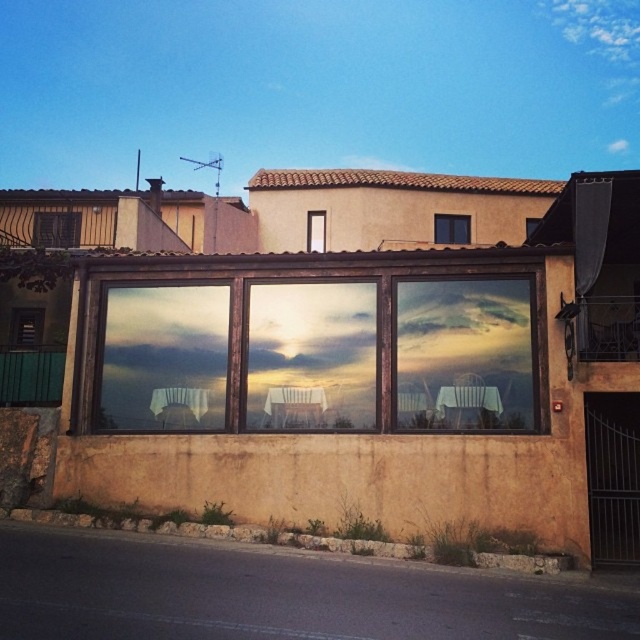
You are standing on the paved street in front of the building. You see two points marked in the image. The first point is at coordinate point (x=12, y=308) and the second point is at coordinate point (x=314, y=212). Which point is closer to you?

Point (x=12, y=308) is in front of point (x=314, y=212), so the first point is closer to you.

You are standing in front of the building and want to take a photo. You notice two points marked in the scene. The first point is at coordinate point (465,342) and the second is at point (22,310). Which point will appear larger in your photo?

Point (465,342) is closer to the camera than point (22,310), so it will appear larger in the photo.